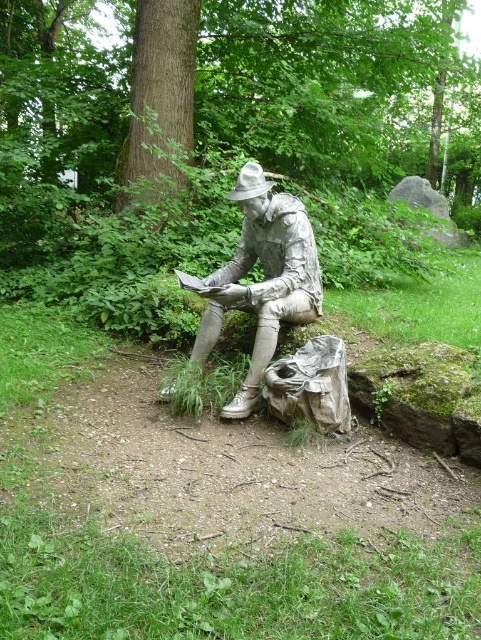
Is brushed metal statue at center closer to the viewer compared to smooth brown bark at center?

Yes, it is.

What do you see at coordinates (263, 278) in the screenshot?
I see `brushed metal statue at center` at bounding box center [263, 278].

Where is `brushed metal statue at center`? Image resolution: width=481 pixels, height=640 pixels. brushed metal statue at center is located at coordinates (263, 278).

How distant is green textured tree at center from brushed metal statue at center?

A distance of 8.69 meters exists between green textured tree at center and brushed metal statue at center.

Does point (347, 60) come closer to viewer compared to point (249, 294)?

No.

The image size is (481, 640). Find the location of `green textured tree at center`. green textured tree at center is located at coordinates (326, 83).

Can you confirm if green textured tree at center is positioned below smooth brown bark at center?

Incorrect, green textured tree at center is not positioned below smooth brown bark at center.

Does green textured tree at center appear over smooth brown bark at center?

Indeed, green textured tree at center is positioned over smooth brown bark at center.

What do you see at coordinates (326, 83) in the screenshot?
I see `green textured tree at center` at bounding box center [326, 83].

Find the location of a particular element. Image resolution: width=481 pixels, height=640 pixels. green textured tree at center is located at coordinates (326, 83).